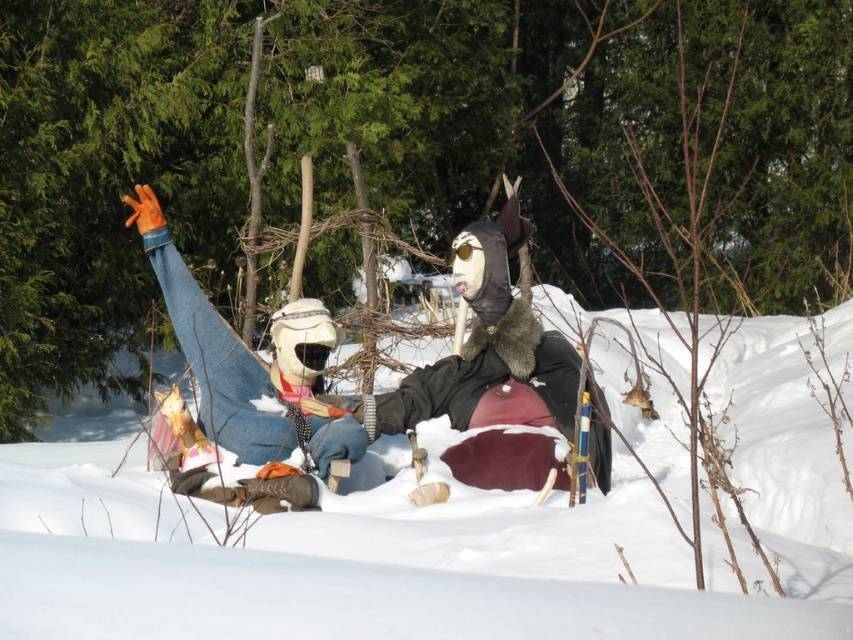
You are standing in the winter scene and notice the white fluffy snow at center and the denim jeans at left. Which object is positioned to the right of the other?

The white fluffy snow at center is to the right of the denim jeans at left.

You are standing in the winter scene and want to place a small snowman between the two points, point (140,573) and point (223,403). Which point should you start building the snowman closer to so it appears larger in the image?

You should start building the snowman closer to point (140,573) because it is closer to the viewer, making the snowman appear larger in the image.

Based on the photo, you are an artist trying to paint the winter scene. You notice the white fluffy snow at center and the denim jeans at left. Which object should you paint first if you want to follow the rule of painting larger objects before smaller ones?

You should paint the white fluffy snow at center first because it is larger than the denim jeans at left.